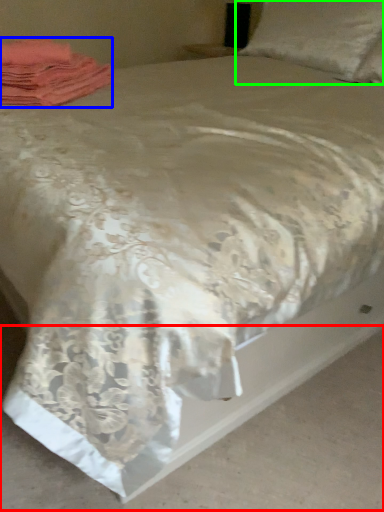
Question: Which object is positioned closest to concrete (highlighted by a red box)? Select from material (highlighted by a blue box) and pillow (highlighted by a green box).

Choices:
 (A) material
 (B) pillow

Answer: (A)